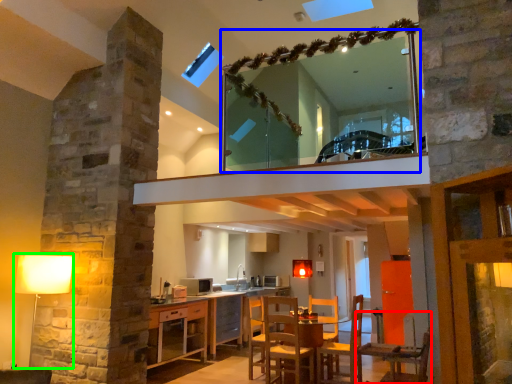
Question: Considering the real-world distances, which object is farthest from chair (highlighted by a red box)? mirror (highlighted by a blue box) or table lamp (highlighted by a green box)?

Choices:
 (A) mirror
 (B) table lamp

Answer: (A)